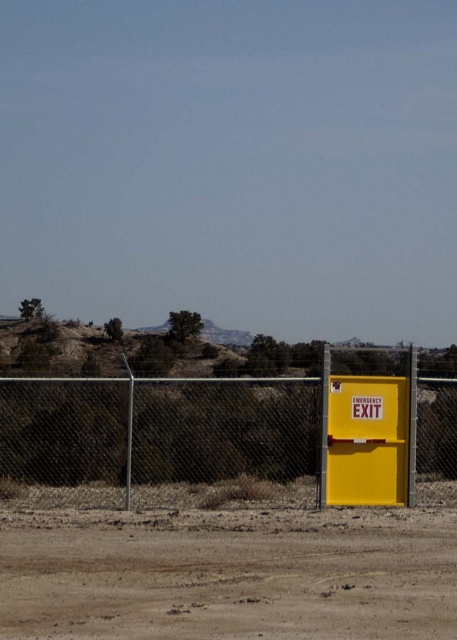
Between metallic chain-link fence at right and yellow matte emergency exit sign at right, which one has less height?

Standing shorter between the two is yellow matte emergency exit sign at right.

Can you confirm if metallic chain-link fence at right is positioned to the left of yellow matte emergency exit sign at right?

Indeed, metallic chain-link fence at right is positioned on the left side of yellow matte emergency exit sign at right.

In order to click on metallic chain-link fence at right in this screenshot , I will do `click(234, 432)`.

At what (x,y) coordinates should I click in order to perform the action: click on metallic chain-link fence at right. Please return your answer as a coordinate pair (x, y). Image resolution: width=457 pixels, height=640 pixels. Looking at the image, I should click on (234, 432).

Does dull brown dirt track at lower center have a larger size compared to yellow matte emergency exit sign at right?

No, dull brown dirt track at lower center is not bigger than yellow matte emergency exit sign at right.

Identify the location of dull brown dirt track at lower center. This screenshot has height=640, width=457. (228, 576).

What do you see at coordinates (228, 576) in the screenshot? The height and width of the screenshot is (640, 457). I see `dull brown dirt track at lower center` at bounding box center [228, 576].

Who is higher up, dull brown dirt track at lower center or metallic chain-link fence at right?

metallic chain-link fence at right is higher up.

Image resolution: width=457 pixels, height=640 pixels. What do you see at coordinates (228, 576) in the screenshot?
I see `dull brown dirt track at lower center` at bounding box center [228, 576].

The width and height of the screenshot is (457, 640). In order to click on dull brown dirt track at lower center in this screenshot , I will do `click(228, 576)`.